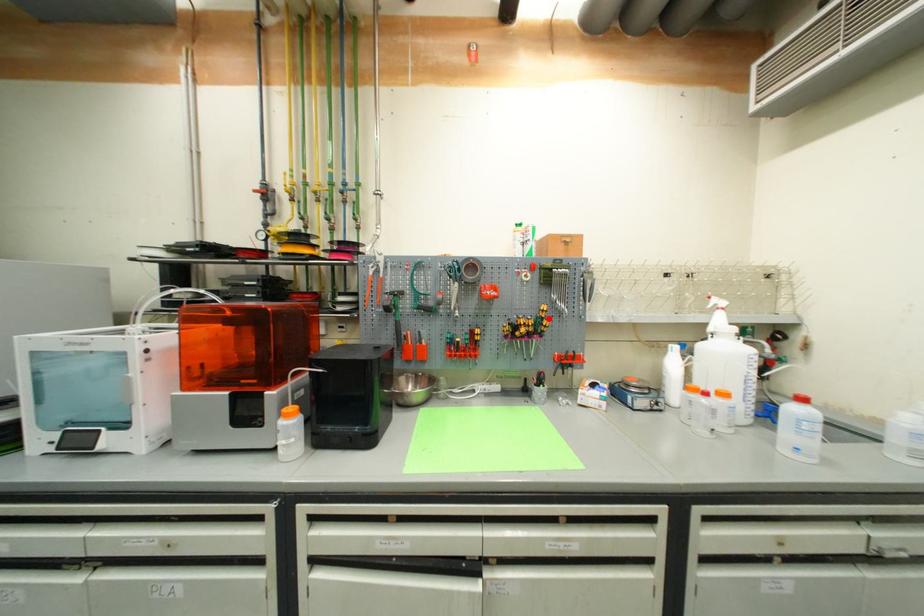
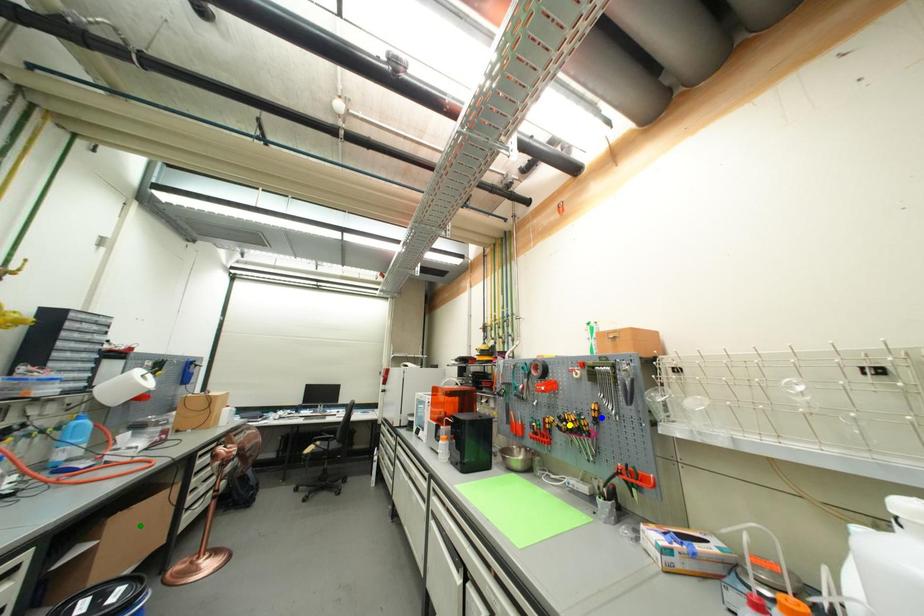
Question: I am providing you with two images of the same scene from different viewpoints. A red point is marked on the first image. You are given multiple points on the second image. Can you choose the point in image 2 that corresponds to the point in image 1?

Choices:
 (A) yellow point
 (B) blue point
 (C) green point

Answer: (B)